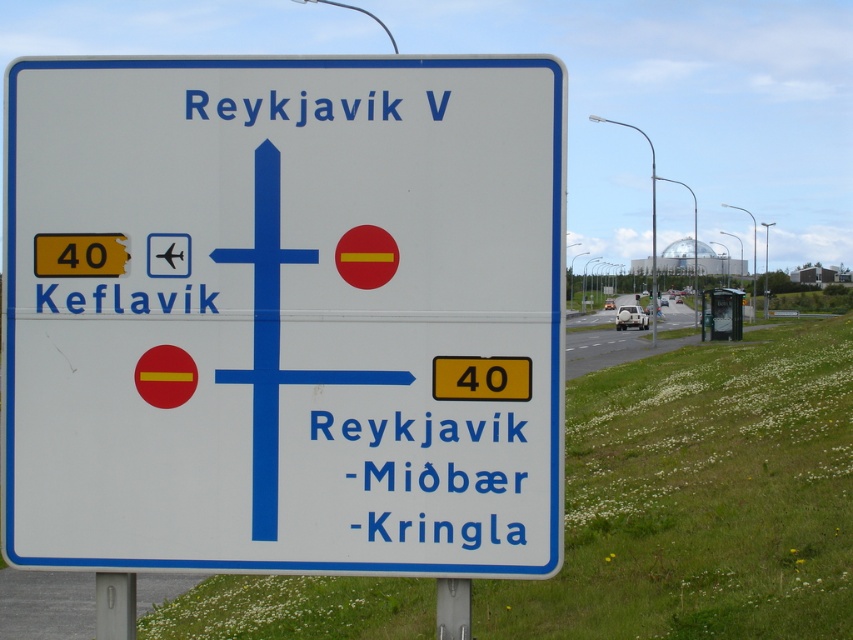
Does blue text at lower center have a larger size compared to black text at lower left?

Indeed, blue text at lower center has a larger size compared to black text at lower left.

This screenshot has height=640, width=853. In order to click on blue text at lower center in this screenshot , I will do `click(415, 429)`.

Does white plastic sign at center appear over blue text at lower center?

Correct, white plastic sign at center is located above blue text at lower center.

Can you confirm if white plastic sign at center is bigger than blue text at lower center?

Yes.

Is point (223, 444) farther from viewer compared to point (444, 492)?

That is True.

In order to click on white plastic sign at center in this screenshot , I will do `click(286, 317)`.

Is point (248, 115) more distant than point (186, 301)?

No, (248, 115) is closer to viewer.

Does point (186, 90) come in front of point (207, 292)?

Yes.

Identify the location of white plastic text at upper center. This screenshot has height=640, width=853. (334, 108).